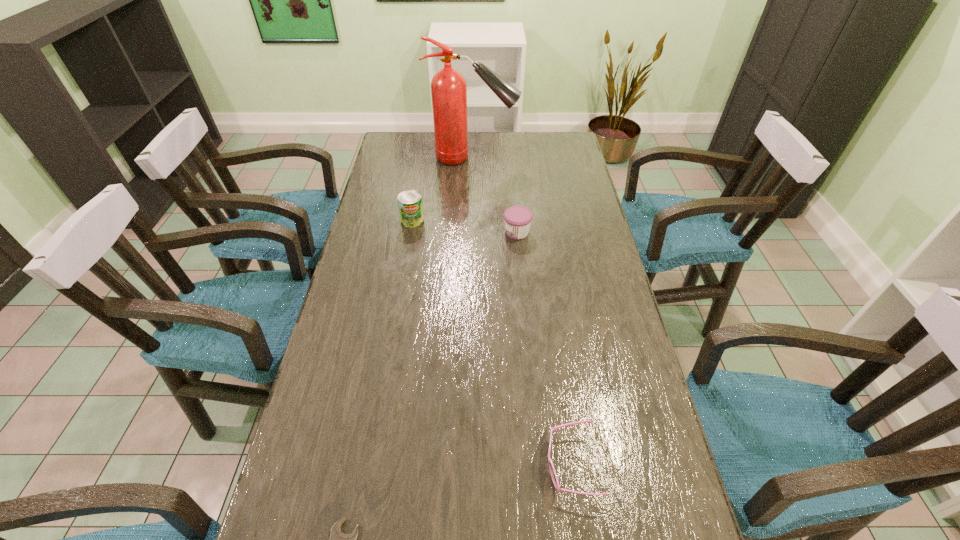
Identify the location of the farthest object. The image size is (960, 540). (448, 87).

Where is `the tallest object`? The image size is (960, 540). the tallest object is located at coordinates (448, 87).

Identify the location of the fourth shortest object. This screenshot has height=540, width=960. (410, 205).

The width and height of the screenshot is (960, 540). What are the coordinates of `jam` in the screenshot? It's located at (517, 219).

Where is `the fourth farthest object`? The width and height of the screenshot is (960, 540). the fourth farthest object is located at coordinates (553, 474).

You are a GUI agent. You are given a task and a screenshot of the screen. Output one action in this format:
    pyautogui.click(x=<x>, y=<y>)
    Task: Click on the second shortest object
    The image size is (960, 540).
    Given the screenshot: What is the action you would take?
    pyautogui.click(x=553, y=474)

Image resolution: width=960 pixels, height=540 pixels. Identify the location of free location located 0.130m at the nozzle end of the fire extinguisher. (550, 158).

This screenshot has height=540, width=960. Identify the location of vacant space located on the left of the second tallest object. (363, 220).

Where is `vacant space located 0.350m on the front label of the third tallest object`? This screenshot has width=960, height=540. vacant space located 0.350m on the front label of the third tallest object is located at coordinates (396, 232).

Where is `vacant space positioned 0.260m on the front label of the third tallest object`? This screenshot has height=540, width=960. vacant space positioned 0.260m on the front label of the third tallest object is located at coordinates pos(423,232).